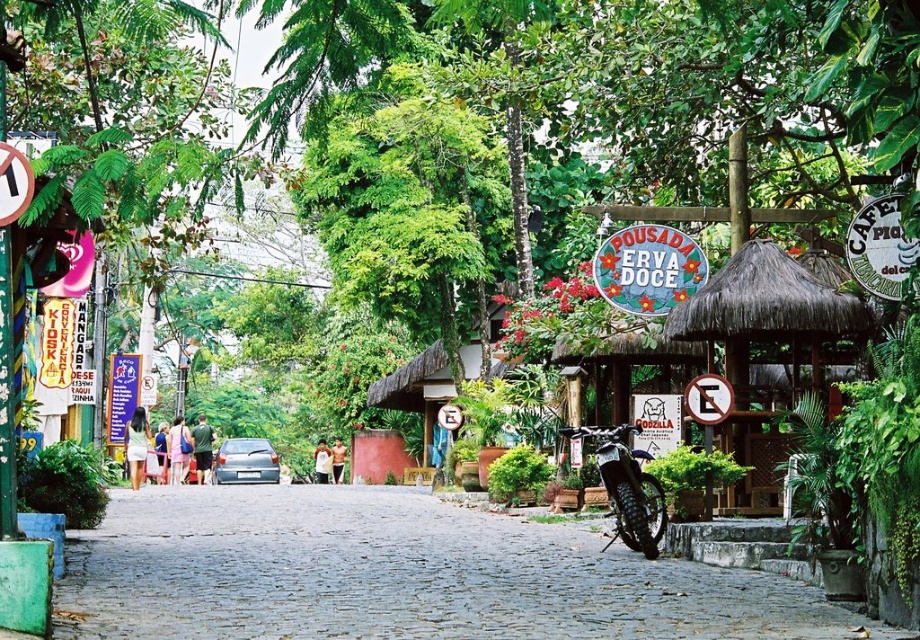
Does point (618, 525) come closer to viewer compared to point (273, 472)?

Yes.

In the scene shown: Which is below, metallic silver motorcycle at center or silver metallic car at center?

silver metallic car at center

Which is behind, point (625, 538) or point (263, 458)?

The point (263, 458) is more distant.

Locate an element on the screen. This screenshot has width=920, height=640. metallic silver motorcycle at center is located at coordinates (627, 486).

Is point (731, 339) closer to viewer compared to point (263, 451)?

Yes, point (731, 339) is in front of point (263, 451).

Is point (719, 310) farther from camera compared to point (249, 477)?

That is False.

Where is `thatched roof hut at center`? This screenshot has height=640, width=920. thatched roof hut at center is located at coordinates (763, 308).

This screenshot has width=920, height=640. Identify the location of thatched roof hut at center. (763, 308).

Between point (803, 301) and point (637, 428), which one is positioned in front?

Point (637, 428) is in front.

Is thatched roof hut at center thinner than metallic silver motorcycle at center?

Incorrect, thatched roof hut at center's width is not less than metallic silver motorcycle at center's.

Does point (683, 337) come behind point (606, 460)?

Yes, point (683, 337) is behind point (606, 460).

Identify the location of thatched roof hut at center. The height and width of the screenshot is (640, 920). (763, 308).